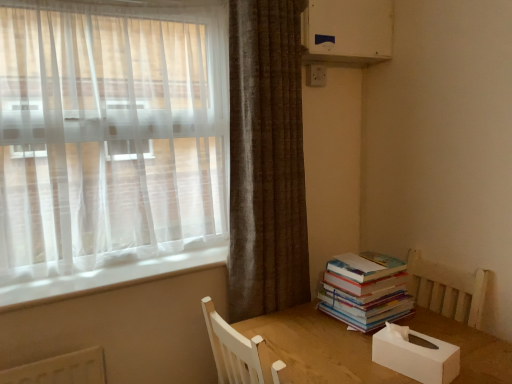
Question: Is white plastic window sill at lower left in front of brown textured curtain at upper right, arranged as the 1th curtain when viewed from the right?

Choices:
 (A) yes
 (B) no

Answer: (A)

Question: Could brown textured curtain at upper right, arranged as the 1th curtain when viewed from the right, be considered to be inside white plastic window sill at lower left?

Choices:
 (A) no
 (B) yes

Answer: (A)

Question: Can you confirm if white plastic window sill at lower left is smaller than brown textured curtain at upper right, arranged as the 1th curtain when viewed from the right?

Choices:
 (A) yes
 (B) no

Answer: (A)

Question: Is white plastic window sill at lower left at the right side of brown textured curtain at upper right, arranged as the 1th curtain when viewed from the right?

Choices:
 (A) yes
 (B) no

Answer: (B)

Question: Considering the relative sizes of white plastic window sill at lower left and brown textured curtain at upper right, arranged as the 1th curtain when viewed from the right, in the image provided, is white plastic window sill at lower left shorter than brown textured curtain at upper right, arranged as the 1th curtain when viewed from the right,?

Choices:
 (A) no
 (B) yes

Answer: (B)

Question: Is white plastic window sill at lower left next to brown textured curtain at upper right, arranged as the 1th curtain when viewed from the right, and touching it?

Choices:
 (A) yes
 (B) no

Answer: (B)

Question: From the image's perspective, would you say white plastic air conditioning unit at upper right is shown under white plastic electric outlet at upper center?

Choices:
 (A) yes
 (B) no

Answer: (B)

Question: Is the depth of white plastic air conditioning unit at upper right greater than that of white plastic electric outlet at upper center?

Choices:
 (A) no
 (B) yes

Answer: (A)

Question: Is white plastic air conditioning unit at upper right directly adjacent to white plastic electric outlet at upper center?

Choices:
 (A) yes
 (B) no

Answer: (B)

Question: Is white plastic air conditioning unit at upper right not close to white plastic electric outlet at upper center?

Choices:
 (A) yes
 (B) no

Answer: (B)

Question: Can you confirm if white plastic air conditioning unit at upper right is taller than white plastic electric outlet at upper center?

Choices:
 (A) no
 (B) yes

Answer: (B)

Question: Is white plastic air conditioning unit at upper right smaller than white plastic electric outlet at upper center?

Choices:
 (A) yes
 (B) no

Answer: (B)

Question: Is sheer white curtain at left, marked as the second curtain in a right-to-left arrangement, wider than white plastic electric outlet at upper center?

Choices:
 (A) no
 (B) yes

Answer: (B)